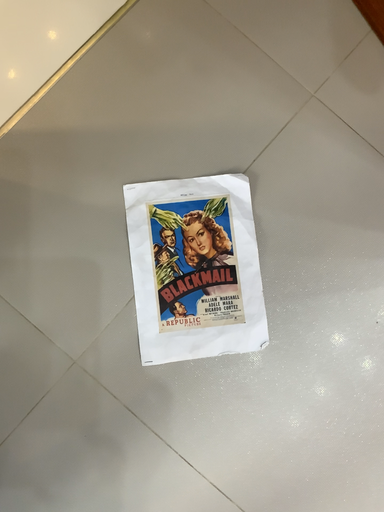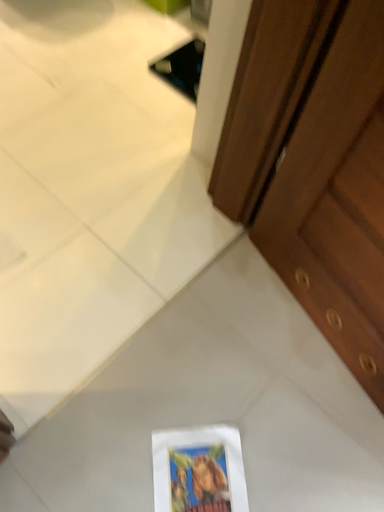
Question: How did the camera likely rotate when shooting the video?

Choices:
 (A) rotated downward
 (B) rotated upward

Answer: (B)